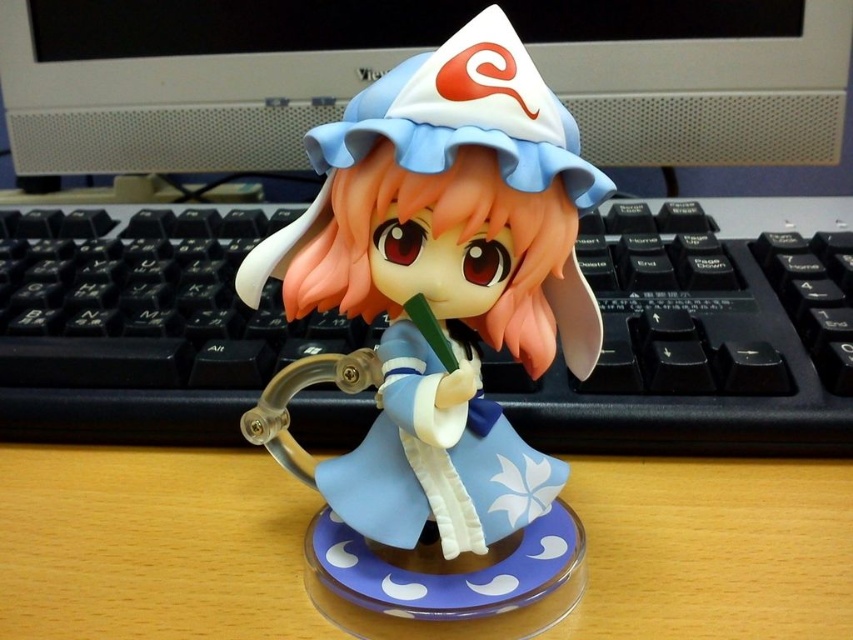
Does matte white computer monitor at upper center appear over wooden table at center?

Correct, matte white computer monitor at upper center is located above wooden table at center.

Is matte white computer monitor at upper center behind wooden table at center?

Yes, it is behind wooden table at center.

Identify the location of matte white computer monitor at upper center. [x=402, y=58].

Does wooden desk at center appear on the left side of matte white computer monitor at upper center?

Indeed, wooden desk at center is positioned on the left side of matte white computer monitor at upper center.

Is wooden desk at center above matte white computer monitor at upper center?

No.

At what (x,y) coordinates should I click in order to perform the action: click on wooden desk at center. Please return your answer as a coordinate pair (x, y). Image resolution: width=853 pixels, height=640 pixels. Looking at the image, I should click on (144, 429).

The width and height of the screenshot is (853, 640). I want to click on wooden desk at center, so coord(144,429).

Between point (215, 433) and point (724, 541), which one is positioned in front?

Point (724, 541) is more forward.

In the scene shown: Between wooden desk at center and wooden table at center, which one appears on the right side from the viewer's perspective?

Positioned to the right is wooden desk at center.

Which is in front, point (38, 624) or point (38, 611)?

Point (38, 624)

Identify the location of wooden desk at center. (144, 429).